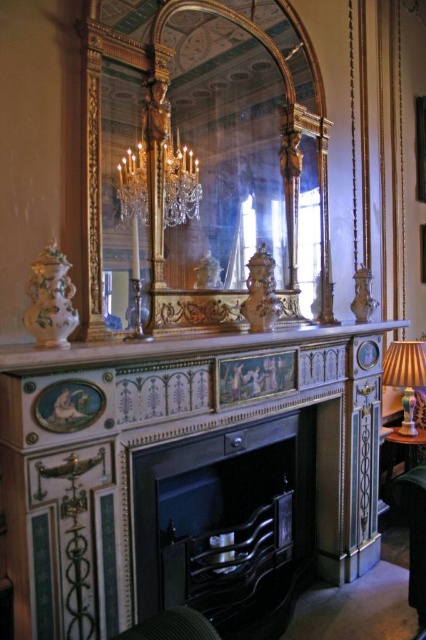
Is the position of white marble mantelpiece at center more distant than that of wooden table at lower right?

No, it is not.

Does white marble mantelpiece at center appear on the right side of wooden table at lower right?

No, white marble mantelpiece at center is not to the right of wooden table at lower right.

From the picture: Who is more distant from viewer, (299,337) or (397,440)?

The point (397,440) is more distant.

Image resolution: width=426 pixels, height=640 pixels. I want to click on white marble mantelpiece at center, so click(180, 346).

How far apart are gold/gilded mirror at center and white marble mantelpiece at center?

23.70 inches

Does point (258, 22) come in front of point (48, 356)?

No, it is behind (48, 356).

Locate an element on the screen. The image size is (426, 640). gold/gilded mirror at center is located at coordinates [203, 166].

Which is below, gold/gilded mirror at center or matte gold lampshade at right?

matte gold lampshade at right is below.

Does point (241, 240) lie in front of point (393, 369)?

That is True.

Where is `gold/gilded mirror at center`? The width and height of the screenshot is (426, 640). gold/gilded mirror at center is located at coordinates (203, 166).